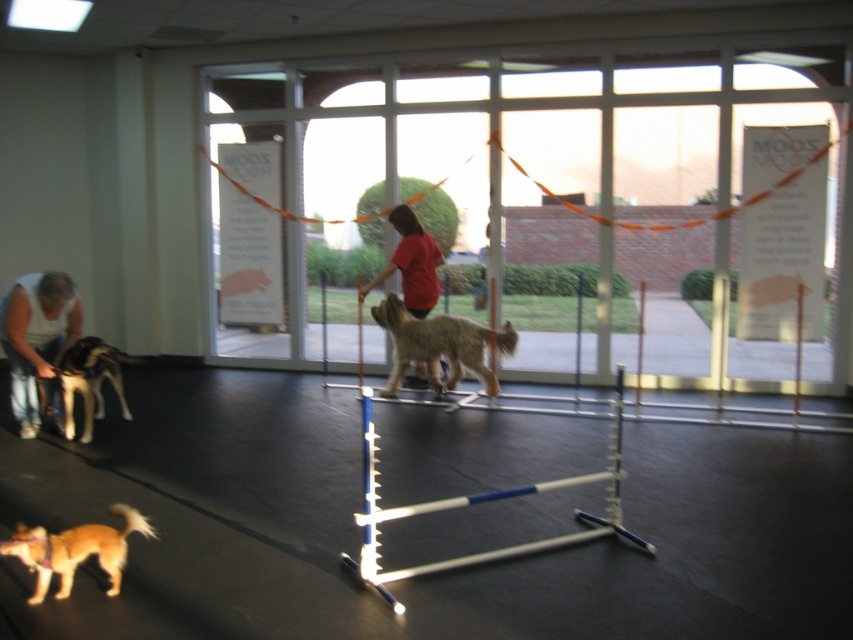
Question: Which object is farther from the camera taking this photo?

Choices:
 (A) light brown fur at left
 (B) transparent glass door at center
 (C) red cotton shirt at center

Answer: (B)

Question: Can you confirm if white plastic hurdle at center is thinner than red cotton shirt at center?

Choices:
 (A) yes
 (B) no

Answer: (B)

Question: Can you confirm if transparent glass door at center is positioned to the left of light brown fur at left?

Choices:
 (A) yes
 (B) no

Answer: (B)

Question: Estimate the real-world distances between objects in this image. Which object is farther from the fuzzy brown dog at center?

Choices:
 (A) red cotton shirt at center
 (B) white plastic hurdle at center

Answer: (B)

Question: Is fuzzy brown dog at center above light brown fur at left?

Choices:
 (A) yes
 (B) no

Answer: (A)

Question: Which object appears closest to the camera in this image?

Choices:
 (A) white plastic hurdle at center
 (B) fuzzy brown dog at center
 (C) transparent glass door at center

Answer: (A)